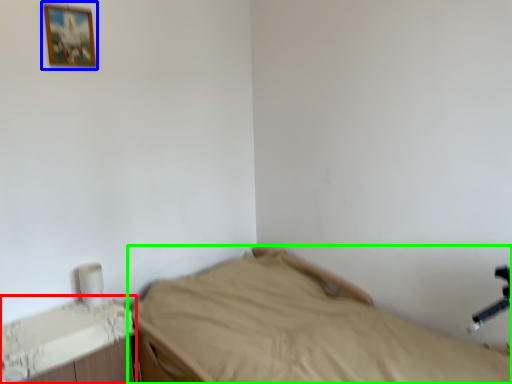
Question: Considering the real-world distances, which object is farthest from changing table (highlighted by a red box)? picture frame (highlighted by a blue box) or bed (highlighted by a green box)?

Choices:
 (A) picture frame
 (B) bed

Answer: (A)